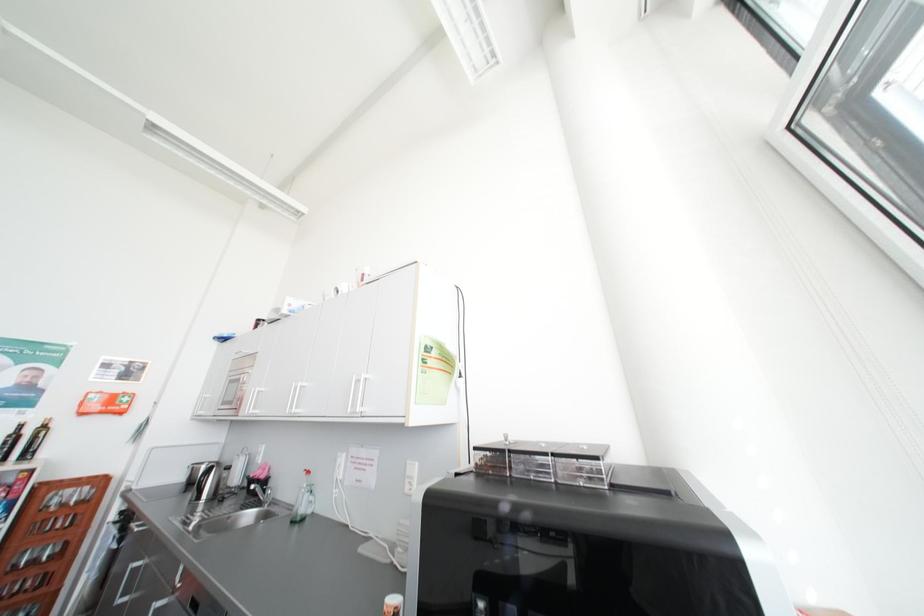
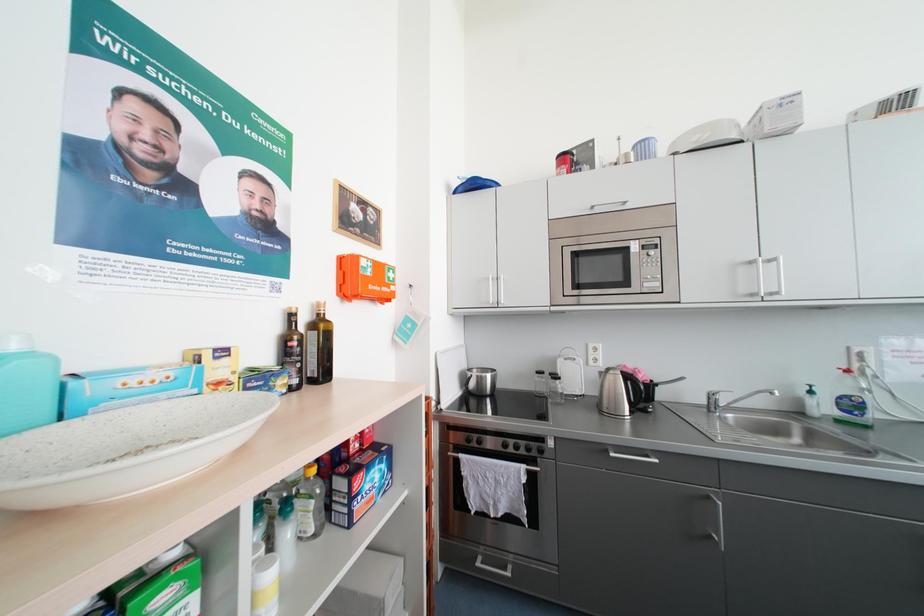
Question: Which direction would the cameraman need to move to produce the second image? Reply with the corresponding letter.

Choices:
 (A) Left
 (B) Right
 (C) Forward
 (D) Backward

Answer: (A)